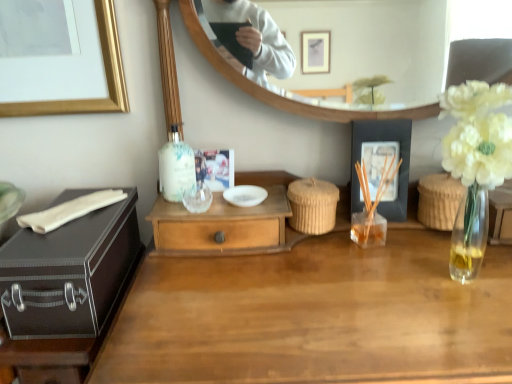
Image resolution: width=512 pixels, height=384 pixels. Describe the element at coordinates (313, 205) in the screenshot. I see `woven straw picnic basket at center, which is the 1th picnic basket in left-to-right order` at that location.

What do you see at coordinates (68, 273) in the screenshot? Image resolution: width=512 pixels, height=384 pixels. I see `matte black suitcase at left` at bounding box center [68, 273].

Measure the distance between clear glass vase at right, the 1th picnic basket viewed from the right, and camera.

A distance of 35.51 inches exists between clear glass vase at right, the 1th picnic basket viewed from the right, and camera.

The image size is (512, 384). In order to click on transparent glass wine glass at center in this screenshot , I will do `click(198, 198)`.

Locate an element on the screen. This screenshot has width=512, height=384. woven straw picnic basket at center, which is the 1th picnic basket in left-to-right order is located at coordinates (313, 205).

Is translucent glass bottle at upper center placed right next to wooden desk at center?

No, translucent glass bottle at upper center is not touching wooden desk at center.

Which is behind, translucent glass bottle at upper center or wooden desk at center?

translucent glass bottle at upper center.

Is translucent glass bottle at upper center spatially inside wooden desk at center, or outside of it?

translucent glass bottle at upper center is spatially situated outside wooden desk at center.

From the picture: Considering the relative positions of transparent glass wine glass at center and wooden desk at center in the image provided, is transparent glass wine glass at center in front of wooden desk at center?

No, the depth of transparent glass wine glass at center is greater than that of wooden desk at center.

Is transparent glass wine glass at center far from wooden desk at center?

No, transparent glass wine glass at center is not far away from wooden desk at center.

Considering the positions of point (201, 202) and point (125, 344), is point (201, 202) closer or farther from the camera than point (125, 344)?

Point (201, 202).

Would you say wooden desk at center is part of transparent glass wine glass at center's contents?

No, wooden desk at center is not inside transparent glass wine glass at center.

Is transparent glass wine glass at center completely or partially inside matte black suitcase at left?

That's incorrect, transparent glass wine glass at center is not inside matte black suitcase at left.

Does matte black suitcase at left lie in front of transparent glass wine glass at center?

That is True.

Consider the image. Is matte black suitcase at left facing away from transparent glass wine glass at center?

No, matte black suitcase at left's orientation is not away from transparent glass wine glass at center.

Between wooden drawer at center and white glossy bowl at center, which one is positioned behind?

white glossy bowl at center is more distant.

Where is `dresser in front of the white glossy bowl at center`? dresser in front of the white glossy bowl at center is located at coordinates (227, 222).

From the image's perspective, is transparent glass wine glass at center above clear glass vase at right, the 2th picnic basket in the left-to-right sequence?

Indeed, from the image's perspective, transparent glass wine glass at center is shown above clear glass vase at right, the 2th picnic basket in the left-to-right sequence.

Is transparent glass wine glass at center smaller than clear glass vase at right, the 2th picnic basket in the left-to-right sequence?

Yes.

Consider the image. Is transparent glass wine glass at center positioned before clear glass vase at right, the 2th picnic basket in the left-to-right sequence?

No, it is not.

Is point (234, 188) positioned in front of point (201, 190)?

No.

From a real-world perspective, is white glossy bowl at center physically below transparent glass wine glass at center?

Yes.

Between white glossy bowl at center and transparent glass wine glass at center, which one has more height?

transparent glass wine glass at center.

The width and height of the screenshot is (512, 384). In the image, there is a transparent glass wine glass at center. In order to click on bowl below it (from a real-world perspective) in this screenshot , I will do `click(245, 195)`.

From a real-world perspective, is wooden desk at center positioned over woven straw picnic basket at center, the second picnic basket from the right, based on gravity?

Incorrect, from a real-world perspective, wooden desk at center is lower than woven straw picnic basket at center, the second picnic basket from the right.

Would you consider wooden desk at center to be distant from woven straw picnic basket at center, which is the 1th picnic basket in left-to-right order?

Actually, wooden desk at center and woven straw picnic basket at center, which is the 1th picnic basket in left-to-right order, are a little close together.

From the image's perspective, is wooden desk at center beneath woven straw picnic basket at center, the second picnic basket from the right?

Indeed, from the image's perspective, wooden desk at center is shown beneath woven straw picnic basket at center, the second picnic basket from the right.

I want to click on desk that is in front of the woven straw picnic basket at center, the second picnic basket from the right, so click(x=315, y=316).

Where is `bottle behind the wooden desk at center`? This screenshot has width=512, height=384. bottle behind the wooden desk at center is located at coordinates (176, 166).

I want to click on desk below the transparent glass wine glass at center (from a real-world perspective), so click(x=315, y=316).

When comparing their distances from black matte picture frame at right, does matte black suitcase at left or wooden drawer at center seem further?

matte black suitcase at left.

In the scene shown: Estimate the real-world distances between objects in this image. Which object is closer to wooden desk at center, black matte picture frame at right or wooden drawer at center?

Based on the image, wooden drawer at center appears to be nearer to wooden desk at center.

From the image, which object appears to be nearer to matte black suitcase at left, woven straw picnic basket at center, which is the 1th picnic basket in left-to-right order, or white glossy bowl at center?

Among the two, white glossy bowl at center is located nearer to matte black suitcase at left.

Based on the photo, from the image, which object appears to be farther from white glossy bowl at center, black matte picture frame at right or wooden desk at center?

wooden desk at center is positioned further to the anchor white glossy bowl at center.

Which object lies nearer to the anchor point translucent glass bottle at upper center, matte black suitcase at left or transparent glass wine glass at center?

Among the two, transparent glass wine glass at center is located nearer to translucent glass bottle at upper center.

Which object lies nearer to the anchor point clear glass vase at right, the 1th picnic basket viewed from the right, woven straw picnic basket at center, which is the 1th picnic basket in left-to-right order, or white glossy bowl at center?

woven straw picnic basket at center, which is the 1th picnic basket in left-to-right order, is closer to clear glass vase at right, the 1th picnic basket viewed from the right.

Based on their spatial positions, is wooden drawer at center or clear glass vase at right, the 1th picnic basket viewed from the right, closer to black matte picture frame at right?

clear glass vase at right, the 1th picnic basket viewed from the right, lies closer to black matte picture frame at right than the other object.

From the image, which object appears to be nearer to woven straw picnic basket at center, which is the 1th picnic basket in left-to-right order, transparent glass wine glass at center or black matte picture frame at right?

black matte picture frame at right.

At what (x,y) coordinates should I click in order to perform the action: click on bowl between transparent glass wine glass at center and clear glass vase at right, the 2th picnic basket in the left-to-right sequence, in the horizontal direction. Please return your answer as a coordinate pair (x, y). Looking at the image, I should click on (245, 195).

Locate an element on the screen. Image resolution: width=512 pixels, height=384 pixels. dresser between translucent glass bottle at upper center and clear glass vase at right, the 2th picnic basket in the left-to-right sequence, in the horizontal direction is located at coordinates (227, 222).

You are a GUI agent. You are given a task and a screenshot of the screen. Output one action in this format:
    pyautogui.click(x=<x>, y=<y>)
    Task: Click on the dresser that lies between black matte picture frame at right and wooden desk at center from top to bottom
    This screenshot has width=512, height=384.
    Given the screenshot: What is the action you would take?
    pyautogui.click(x=227, y=222)

At what (x,y) coordinates should I click in order to perform the action: click on wine glass between white glossy bowl at center and wooden desk at center in the vertical direction. Please return your answer as a coordinate pair (x, y). Image resolution: width=512 pixels, height=384 pixels. Looking at the image, I should click on (198, 198).